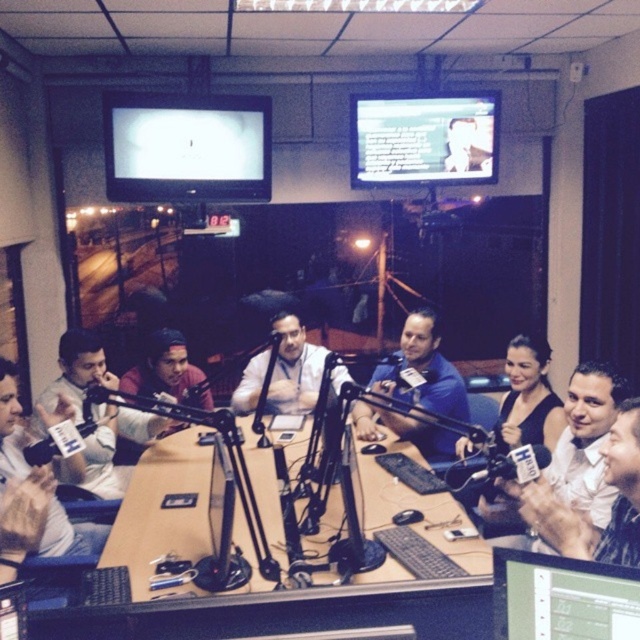
Who is positioned more to the right, brown wooden table at center or white glossy microphone at center?

Positioned to the right is white glossy microphone at center.

Does brown wooden table at center appear on the left side of white glossy microphone at center?

Correct, you'll find brown wooden table at center to the left of white glossy microphone at center.

Which is behind, point (275, 518) or point (592, 401)?

Positioned behind is point (275, 518).

Where is `brown wooden table at center`? This screenshot has height=640, width=640. brown wooden table at center is located at coordinates (272, 582).

Does white glossy microphone at center have a larger size compared to matte black microphone at center?

Actually, white glossy microphone at center might be smaller than matte black microphone at center.

Locate an element on the screen. This screenshot has width=640, height=640. white glossy microphone at center is located at coordinates (586, 442).

Where is `white glossy microphone at center`? The height and width of the screenshot is (640, 640). white glossy microphone at center is located at coordinates (586, 442).

Is brown wooden table at center smaller than matte black microphone at center?

Incorrect, brown wooden table at center is not smaller in size than matte black microphone at center.

Is point (378, 616) closer to viewer compared to point (182, 353)?

Yes, point (378, 616) is in front of point (182, 353).

At what (x,y) coordinates should I click in order to perform the action: click on brown wooden table at center. Please return your answer as a coordinate pair (x, y). Looking at the image, I should click on (272, 582).